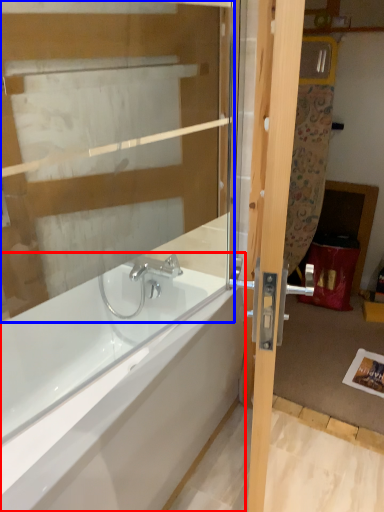
Question: Which object appears closest to the camera in this image, bathtub (highlighted by a red box) or glass door (highlighted by a blue box)?

Choices:
 (A) bathtub
 (B) glass door

Answer: (B)